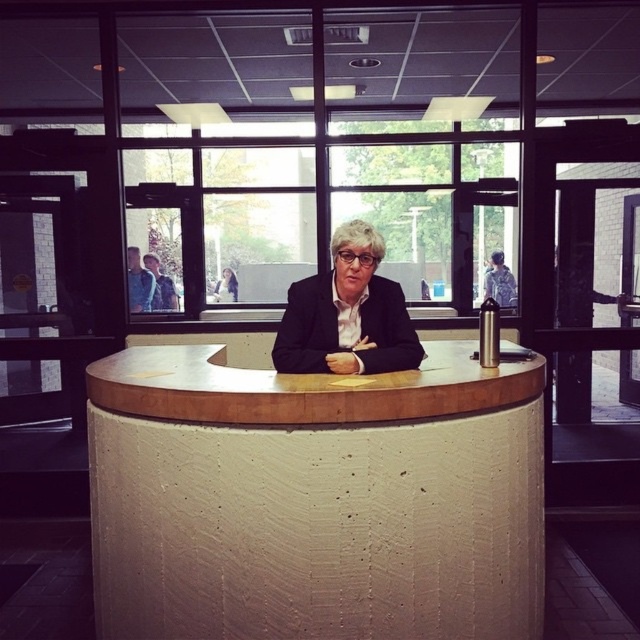
In the scene shown: You are an interior designer assessing the space between the white textured table at center and the black matte blazer at center. Can you determine if the table is wider than the blazer?

The white textured table at center is wider than the black matte blazer at center according to the description provided.

What is located at the coordinates point (314,499) in the image?

The white textured table at center is located at point (314,499).

You are organizing a meeting and need to place a 12 inch laptop between the white textured table at center and the black matte blazer at center. Is there enough space to fit the laptop between them?

The white textured table at center is 14.67 inches away from the black matte blazer at center. Since the laptop is 12 inches long, there is sufficient space to place it between them as the distance between the two objects is greater than the laptop length.